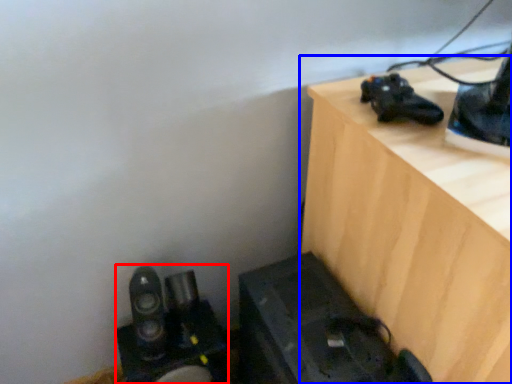
Question: Among these objects, which one is nearest to the camera, equipment (highlighted by a red box) or furniture (highlighted by a blue box)?

Choices:
 (A) equipment
 (B) furniture

Answer: (B)